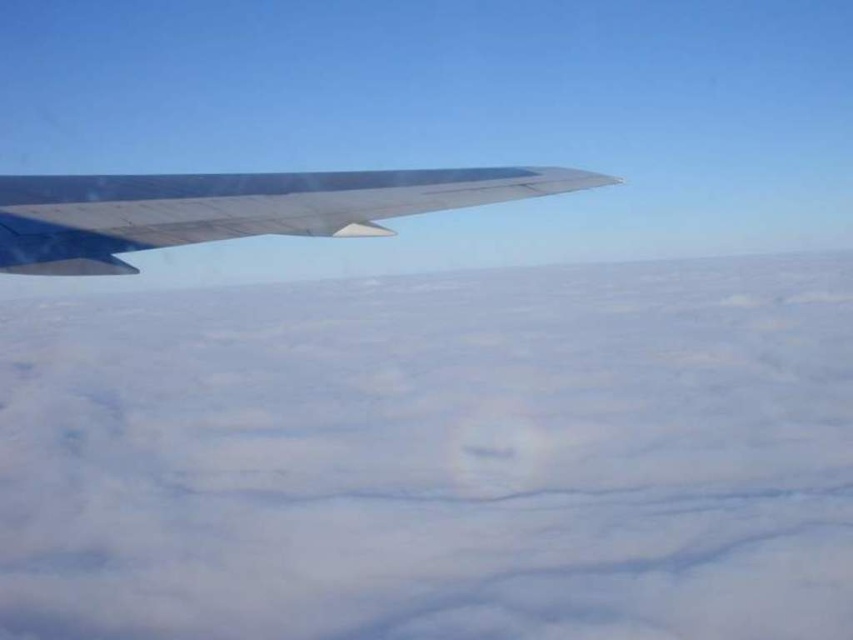
Question: Among these points, which one is farthest from the camera?

Choices:
 (A) (633, 266)
 (B) (305, 189)

Answer: (A)

Question: Does white fluffy cloud at upper left appear over metallic gray wing at upper left?

Choices:
 (A) yes
 (B) no

Answer: (A)

Question: Is white fluffy cloud at upper left bigger than metallic gray wing at upper left?

Choices:
 (A) yes
 (B) no

Answer: (A)

Question: Is white fluffy cloud at upper left thinner than metallic gray wing at upper left?

Choices:
 (A) no
 (B) yes

Answer: (A)